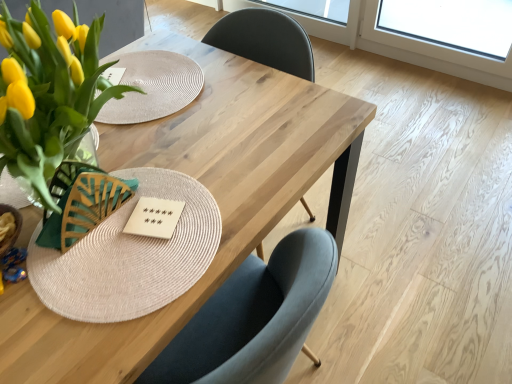
Where is `spots to the right of wooden card game at center`? The height and width of the screenshot is (384, 512). spots to the right of wooden card game at center is located at coordinates (224, 214).